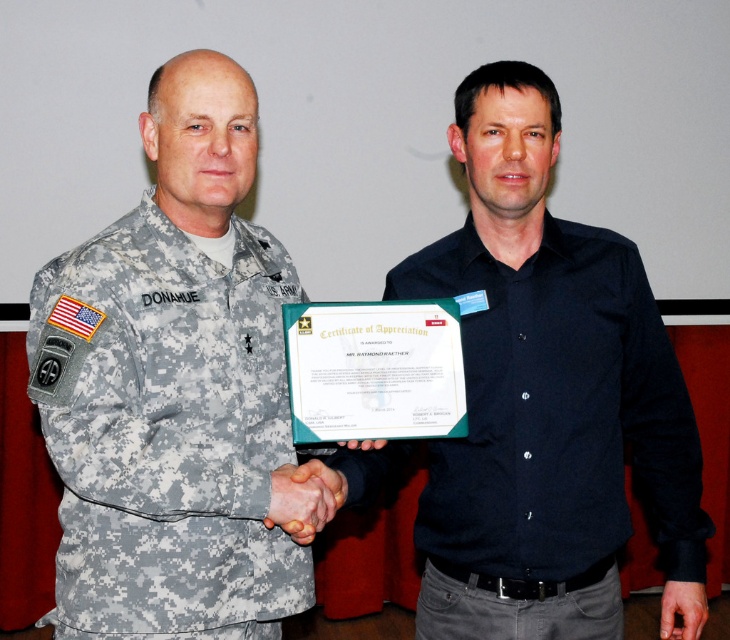
What is the object located at the coordinates point (166, 429) in the image?

The point (166, 429) indicates the camouflage fabric uniform at left.

You are a photographer setting up a photo shoot for a military event. You have two subjects wearing the camouflage fabric uniform at left and the black matte shirt at center. The camera you are using has a minimum focusing distance of 30 centimeters. Can you take a clear photo of both subjects without moving them?

The camouflage fabric uniform at left is 36.78 centimeters from the black matte shirt at center. Since the distance between them is greater than the camera minimum focusing distance of 30 centimeters, you can take a clear photo of both subjects without moving them.

You are a photographer setting up for a group photo. You notice the camouflage fabric uniform at left and the black matte shirt at center in your frame. Which object should you adjust to ensure both are fully visible in the photo?

The camouflage fabric uniform at left is in front of the black matte shirt at center, so you should adjust the camouflage fabric uniform at left to move it back or reposition it to ensure the black matte shirt at center is fully visible.